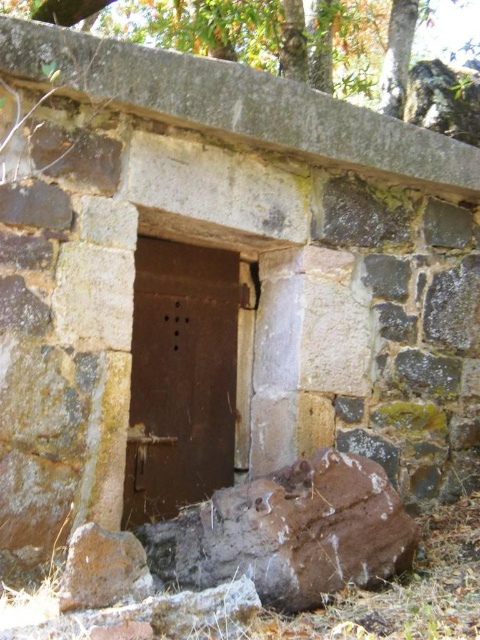
Does brown rough stone at lower center have a lesser height compared to green leafy tree at upper center?

Yes.

The image size is (480, 640). I want to click on brown rough stone at lower center, so click(289, 532).

Is the position of rusty metal door at center less distant than that of green leafy tree at upper center?

Yes.

Between point (176, 513) and point (432, 52), which one is positioned in front?

Point (176, 513) is more forward.

Image resolution: width=480 pixels, height=640 pixels. Find the location of `rusty metal door at center`. rusty metal door at center is located at coordinates (180, 378).

How far apart are brown rough stone at lower center and rusty metal door at center?

The distance of brown rough stone at lower center from rusty metal door at center is 24.80 inches.

Does point (287, 550) come behind point (227, 314)?

That is False.

Between point (211, 548) and point (168, 307), which one is positioned in front?

Positioned in front is point (211, 548).

Find the location of a particular element. This screenshot has height=640, width=480. brown rough stone at lower center is located at coordinates (289, 532).